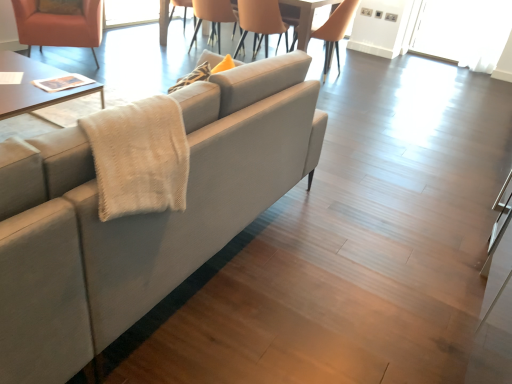
Question: From a real-world perspective, is light brown leather chair at upper center, which is the 4th chair from left to right, on orange leather chair at upper center, which is counted as the third chair, starting from the right?

Choices:
 (A) yes
 (B) no

Answer: (A)

Question: Can you confirm if light brown leather chair at upper center, which is the 4th chair from left to right, is smaller than orange leather chair at upper center, which is counted as the third chair, starting from the right?

Choices:
 (A) no
 (B) yes

Answer: (A)

Question: Can you confirm if light brown leather chair at upper center, positioned as the 1th chair in right-to-left order, is bigger than orange leather chair at upper center, which is counted as the third chair, starting from the right?

Choices:
 (A) no
 (B) yes

Answer: (B)

Question: Is light brown leather chair at upper center, which is the 4th chair from left to right, touching orange leather chair at upper center, which is counted as the third chair, starting from the right?

Choices:
 (A) yes
 (B) no

Answer: (B)

Question: Is there a large distance between light brown leather chair at upper center, which is the 4th chair from left to right, and orange leather chair at upper center, which is counted as the third chair, starting from the right?

Choices:
 (A) yes
 (B) no

Answer: (B)

Question: From the image's perspective, is orange leather chair at upper center, which is counted as the third chair, starting from the right, above or below transparent glass door at upper right?

Choices:
 (A) below
 (B) above

Answer: (A)

Question: From a real-world perspective, is orange leather chair at upper center, which is the 2th chair in left-to-right order, positioned above or below transparent glass door at upper right?

Choices:
 (A) above
 (B) below

Answer: (B)

Question: Is point (219, 34) positioned closer to the camera than point (424, 26)?

Choices:
 (A) farther
 (B) closer

Answer: (B)

Question: Is orange leather chair at upper center, which is the 2th chair in left-to-right order, situated inside transparent glass door at upper right or outside?

Choices:
 (A) outside
 (B) inside

Answer: (A)

Question: Is light brown leather chair at upper center, which is the 4th chair from left to right, in front of or behind wooden glossy table at upper center in the image?

Choices:
 (A) behind
 (B) front

Answer: (A)

Question: Considering the positions of light brown leather chair at upper center, which is the 4th chair from left to right, and wooden glossy table at upper center in the image, is light brown leather chair at upper center, which is the 4th chair from left to right, wider or thinner than wooden glossy table at upper center?

Choices:
 (A) thin
 (B) wide

Answer: (A)

Question: Considering the positions of light brown leather chair at upper center, positioned as the 1th chair in right-to-left order, and wooden glossy table at upper center in the image, is light brown leather chair at upper center, positioned as the 1th chair in right-to-left order, taller or shorter than wooden glossy table at upper center?

Choices:
 (A) short
 (B) tall

Answer: (B)

Question: From a real-world perspective, is light brown leather chair at upper center, positioned as the 1th chair in right-to-left order, physically located above or below wooden glossy table at upper center?

Choices:
 (A) above
 (B) below

Answer: (A)

Question: Considering the relative positions of matte beige chair at upper center, which appears as the third chair when viewed from the left, and transparent glass door at upper right in the image provided, is matte beige chair at upper center, which appears as the third chair when viewed from the left, to the left or to the right of transparent glass door at upper right?

Choices:
 (A) right
 (B) left

Answer: (B)

Question: Does point (252, 23) appear closer or farther from the camera than point (432, 36)?

Choices:
 (A) farther
 (B) closer

Answer: (B)